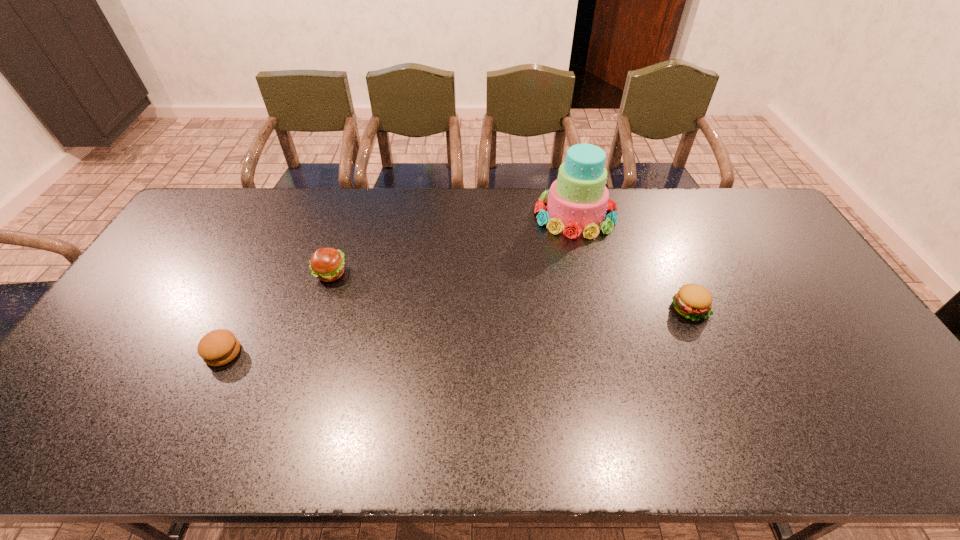
Image resolution: width=960 pixels, height=540 pixels. What are the coordinates of `vacant area that lies between the tallest object and the second tallest hamburger` in the screenshot? It's located at (633, 262).

Where is `free space between the tallest hamburger and the nearest hamburger`? This screenshot has width=960, height=540. free space between the tallest hamburger and the nearest hamburger is located at coordinates (276, 313).

Find the location of a particular element. empty location between the tallest object and the third tallest object is located at coordinates (633, 262).

Locate an element on the screen. vacant space that's between the cake and the second farthest hamburger is located at coordinates (633, 262).

Find the location of `free space between the leftmost hamburger and the rightmost object`. free space between the leftmost hamburger and the rightmost object is located at coordinates (456, 331).

At what (x,y) coordinates should I click in order to perform the action: click on free spot between the second object from right to left and the third object from right to left. Please return your answer as a coordinate pair (x, y). Looking at the image, I should click on (452, 244).

Identify the location of free space between the second shortest hamburger and the leftmost object. (456, 331).

Locate which object is the third closest to the farthest hamburger. Please provide its 2D coordinates. Your answer should be formatted as a tuple, i.e. [(x, y)], where the tuple contains the x and y coordinates of a point satisfying the conditions above.

[(692, 301)]

Find the location of a particular element. object that is the second closest to the second farthest hamburger is located at coordinates (327, 264).

I want to click on the closest hamburger to the rightmost object, so click(327, 264).